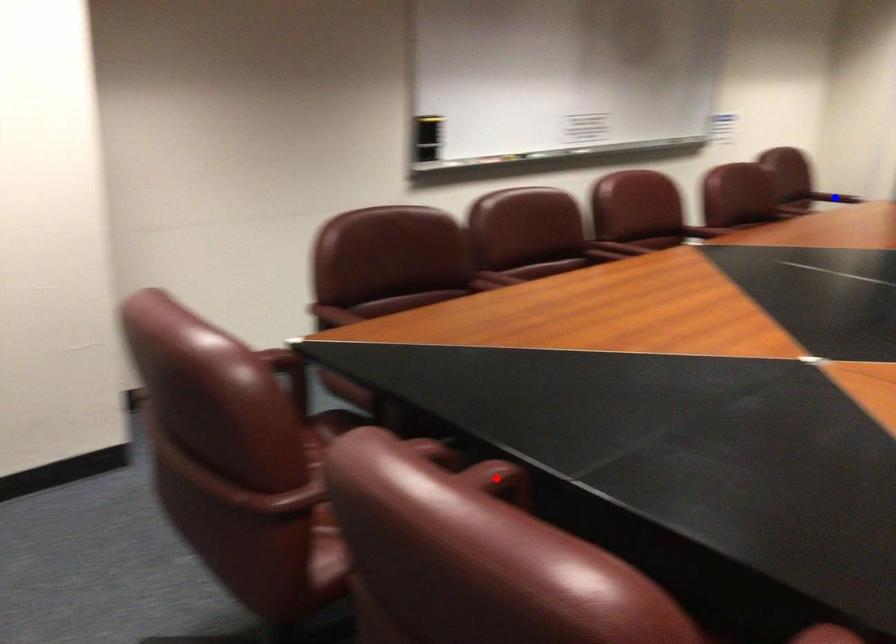
Question: Two points are marked on the image. Which point is closer to the camera?

Choices:
 (A) Blue point is closer.
 (B) Red point is closer.

Answer: (B)